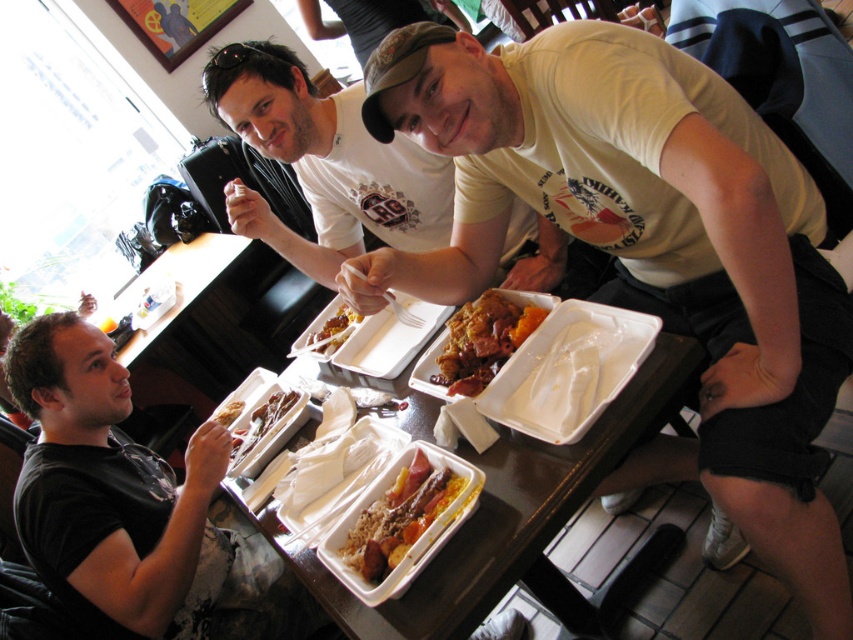
Which is behind, point (397, 173) or point (646, 417)?

Point (397, 173)

The image size is (853, 640). Find the location of `matte white t-shirt at center`. matte white t-shirt at center is located at coordinates (323, 163).

This screenshot has width=853, height=640. What are the coordinates of `matte white t-shirt at center` in the screenshot? It's located at (323, 163).

Can you confirm if golden brown meat at center is smaller than white glossy rice at center?

No, golden brown meat at center is not smaller than white glossy rice at center.

Between golden brown meat at center and white glossy rice at center, which one has more height?

With more height is golden brown meat at center.

Between point (486, 340) and point (213, 420), which one is positioned behind?

Positioned behind is point (213, 420).

Where is `golden brown meat at center`? The image size is (853, 640). golden brown meat at center is located at coordinates (483, 340).

Can you confirm if golden brown meat at center is positioned to the left of yellow matte rice at center?

No, golden brown meat at center is not to the left of yellow matte rice at center.

Who is higher up, golden brown meat at center or yellow matte rice at center?

yellow matte rice at center is above.

Is point (527, 310) positioned before point (339, 337)?

Yes, it is in front of point (339, 337).

At what (x,y) coordinates should I click in order to perform the action: click on golden brown meat at center. Please return your answer as a coordinate pair (x, y). Image resolution: width=853 pixels, height=640 pixels. Looking at the image, I should click on (483, 340).